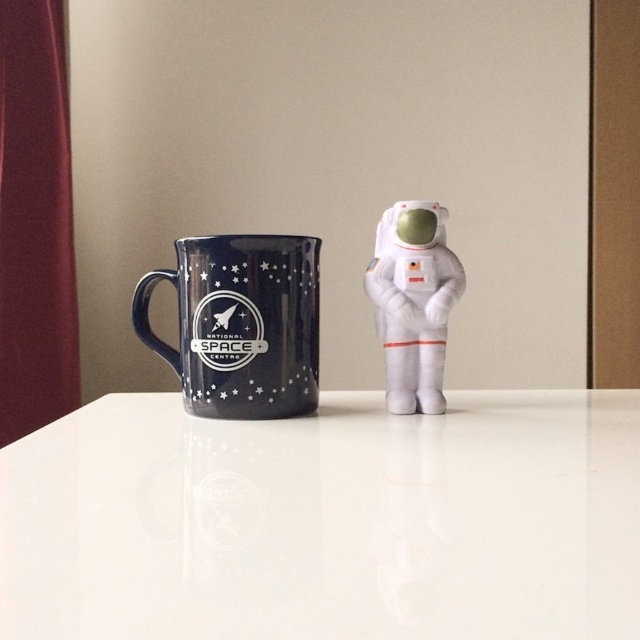
Is white glossy table at center taller than glossy ceramic mug at upper center?

Incorrect, white glossy table at center's height is not larger of glossy ceramic mug at upper center's.

Who is shorter, white glossy table at center or glossy ceramic mug at upper center?

With less height is white glossy table at center.

At what (x,y) coordinates should I click in order to perform the action: click on white glossy table at center. Please return your answer as a coordinate pair (x, y). The width and height of the screenshot is (640, 640). Looking at the image, I should click on (326, 520).

Where is `white glossy table at center`? white glossy table at center is located at coordinates (326, 520).

Is point (438, 524) positioned before point (410, 340)?

That is True.

Does white glossy table at center have a lesser width compared to white plush astronaut at center?

Incorrect, white glossy table at center's width is not less than white plush astronaut at center's.

Who is more forward, (x=634, y=531) or (x=384, y=317)?

Point (x=634, y=531) is more forward.

Identify the location of white glossy table at center. The image size is (640, 640). (326, 520).

Can you confirm if glossy ceramic mug at upper center is positioned to the right of white plush astronaut at center?

No, glossy ceramic mug at upper center is not to the right of white plush astronaut at center.

Who is more forward, (272, 326) or (435, 349)?

Point (272, 326)

I want to click on glossy ceramic mug at upper center, so click(241, 324).